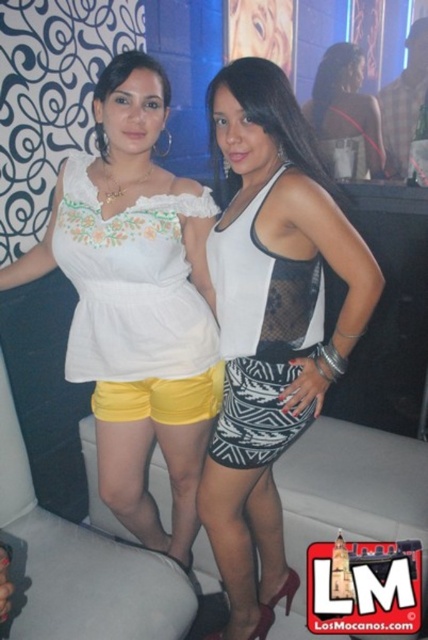
You are standing in the room and see the two women. There is a point at coordinates (272, 326). Which object from the scene does this point lie on?

The point at coordinates (272, 326) lies on the white textured skirt at center.

You are at a party and want to locate the white embroidered top at upper left. According to the coordinates provided, where exactly is it positioned?

The white embroidered top at upper left is located at point (130, 284).